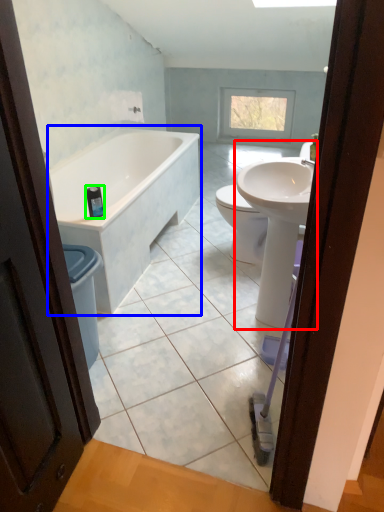
Question: Which object is the closest to the sink (highlighted by a red box)? Choose among these: bathtub (highlighted by a blue box) or toiletry (highlighted by a green box).

Choices:
 (A) bathtub
 (B) toiletry

Answer: (B)